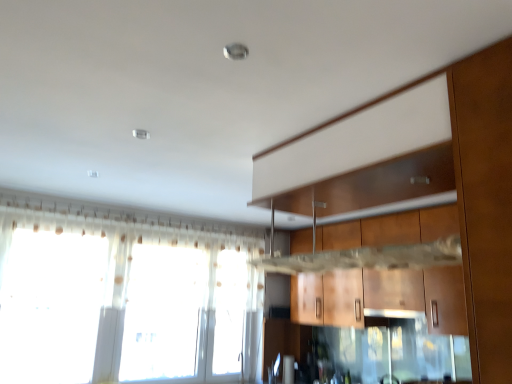
Describe the element at coordinates (382, 297) in the screenshot. I see `wooden cabinet at center` at that location.

Identify the location of translucent fabric window at lower left. (120, 301).

From the picture: Considering the sizes of objects matte white exhaust hood at center and translucent fabric window at lower left in the image provided, who is bigger, matte white exhaust hood at center or translucent fabric window at lower left?

translucent fabric window at lower left.

At what (x,y) coordinates should I click in order to perform the action: click on exhaust hood that appears behind the translucent fabric window at lower left. Please return your answer as a coordinate pair (x, y). This screenshot has height=384, width=512. Looking at the image, I should click on (394, 313).

Is the depth of matte white exhaust hood at center greater than that of translucent fabric window at lower left?

Yes, the depth of matte white exhaust hood at center is greater than that of translucent fabric window at lower left.

Consider the image. From a real-world perspective, who is located higher, matte white exhaust hood at center or translucent fabric window at lower left?

From a 3D spatial view, translucent fabric window at lower left is above.

Is point (58, 333) farther from camera compared to point (376, 315)?

No.

From the image's perspective, is translucent fabric window at lower left above or below matte white exhaust hood at center?

Based on their image positions, translucent fabric window at lower left is located above matte white exhaust hood at center.

Considering the sizes of translucent fabric window at lower left and matte white exhaust hood at center in the image, is translucent fabric window at lower left taller or shorter than matte white exhaust hood at center?

In the image, translucent fabric window at lower left appears to be taller than matte white exhaust hood at center.

From a real-world perspective, is translucent fabric window at lower left above or below matte white exhaust hood at center?

In terms of real-world spatial position, translucent fabric window at lower left is above matte white exhaust hood at center.

Which object is wider, wooden cabinet at center or translucent fabric window at lower left?

With larger width is wooden cabinet at center.

Which of these two, wooden cabinet at center or translucent fabric window at lower left, stands shorter?

Standing shorter between the two is wooden cabinet at center.

Is wooden cabinet at center wider or thinner than matte white exhaust hood at center?

Considering their sizes, wooden cabinet at center looks broader than matte white exhaust hood at center.

Which is behind, point (374, 306) or point (402, 317)?

Positioned behind is point (374, 306).

Could you tell me if wooden cabinet at center is turned towards matte white exhaust hood at center?

Yes, wooden cabinet at center is oriented towards matte white exhaust hood at center.

From a real-world perspective, is wooden cabinet at center located higher than matte white exhaust hood at center?

Correct, in the physical world, wooden cabinet at center is higher than matte white exhaust hood at center.

Is translucent fabric window at lower left directly adjacent to wooden cabinet at center?

No, translucent fabric window at lower left is not beside wooden cabinet at center.

Could you tell me if translucent fabric window at lower left is facing wooden cabinet at center?

Yes, translucent fabric window at lower left is aimed at wooden cabinet at center.

From a real-world perspective, is translucent fabric window at lower left above or below wooden cabinet at center?

Clearly, from a real-world perspective, translucent fabric window at lower left is below wooden cabinet at center.

Considering the positions of objects translucent fabric window at lower left and wooden cabinet at center in the image provided, who is more to the right, translucent fabric window at lower left or wooden cabinet at center?

Positioned to the right is wooden cabinet at center.

Is matte white exhaust hood at center directly adjacent to wooden cabinet at center?

No, matte white exhaust hood at center is not beside wooden cabinet at center.

From the image's perspective, is matte white exhaust hood at center located above or below wooden cabinet at center?

Based on their image positions, matte white exhaust hood at center is located beneath wooden cabinet at center.

From a real-world perspective, who is located lower, matte white exhaust hood at center or wooden cabinet at center?

matte white exhaust hood at center, from a real-world perspective.

At what (x,y) coordinates should I click in order to perform the action: click on exhaust hood lying below the translucent fabric window at lower left (from the image's perspective). Please return your answer as a coordinate pair (x, y). The height and width of the screenshot is (384, 512). Looking at the image, I should click on (394, 313).

In order to click on window on the left of the matte white exhaust hood at center in this screenshot , I will do `click(120, 301)`.

Estimate the real-world distances between objects in this image. Which object is further from translucent fabric window at lower left, wooden cabinet at center or matte white exhaust hood at center?

Based on the image, matte white exhaust hood at center appears to be further to translucent fabric window at lower left.

Based on their spatial positions, is translucent fabric window at lower left or wooden cabinet at center closer to matte white exhaust hood at center?

wooden cabinet at center.

From the image, which object appears to be farther from translucent fabric window at lower left, matte white exhaust hood at center or wooden cabinet at center?

matte white exhaust hood at center lies further to translucent fabric window at lower left than the other object.

Consider the image. Considering their positions, is wooden cabinet at center positioned further to matte white exhaust hood at center than translucent fabric window at lower left?

translucent fabric window at lower left lies further to matte white exhaust hood at center than the other object.

Looking at the image, which one is located further to wooden cabinet at center, translucent fabric window at lower left or matte white exhaust hood at center?

translucent fabric window at lower left is further to wooden cabinet at center.

When comparing their distances from wooden cabinet at center, does matte white exhaust hood at center or translucent fabric window at lower left seem closer?

The object closer to wooden cabinet at center is matte white exhaust hood at center.

Locate an element on the screen. The image size is (512, 384). cabinetry between translucent fabric window at lower left and matte white exhaust hood at center in the horizontal direction is located at coordinates (382, 297).